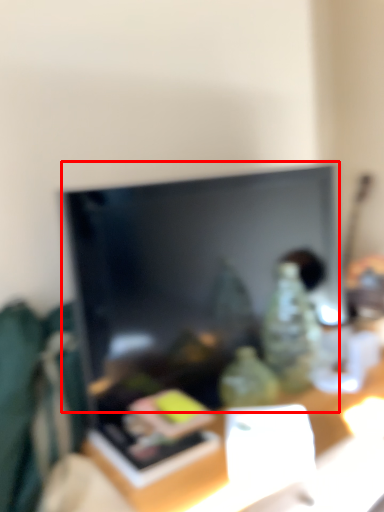
Question: From the image's perspective, what is the correct spatial relationship of television (annotated by the red box) in relation to table?

Choices:
 (A) below
 (B) above

Answer: (B)